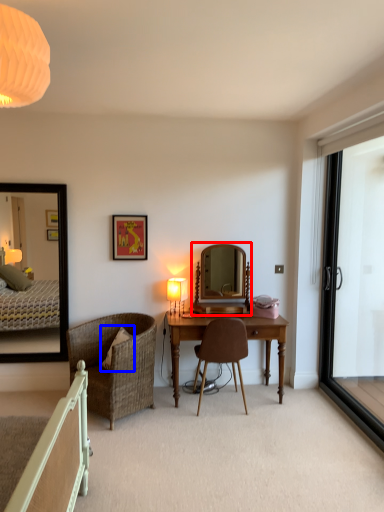
Question: Which of the following is the closest to the observer, mirror (highlighted by a red box) or pillow (highlighted by a blue box)?

Choices:
 (A) mirror
 (B) pillow

Answer: (B)